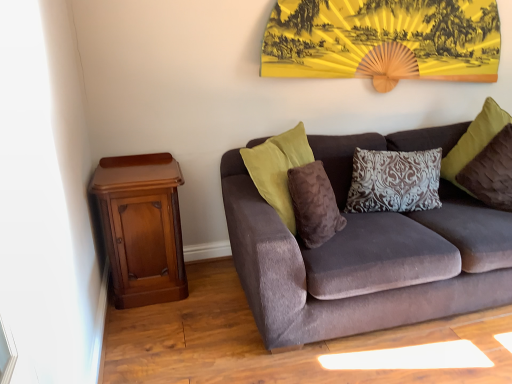
Question: From a real-world perspective, is velvet brown couch at center positioned under mahogany wood nightstand at left based on gravity?

Choices:
 (A) yes
 (B) no

Answer: (B)

Question: Considering the relative positions of velvet brown couch at center and mahogany wood nightstand at left in the image provided, is velvet brown couch at center to the left of mahogany wood nightstand at left from the viewer's perspective?

Choices:
 (A) yes
 (B) no

Answer: (B)

Question: Is velvet brown couch at center taller than mahogany wood nightstand at left?

Choices:
 (A) no
 (B) yes

Answer: (B)

Question: Does velvet brown couch at center lie behind mahogany wood nightstand at left?

Choices:
 (A) yes
 (B) no

Answer: (B)

Question: Considering the relative sizes of velvet brown couch at center and mahogany wood nightstand at left in the image provided, is velvet brown couch at center bigger than mahogany wood nightstand at left?

Choices:
 (A) yes
 (B) no

Answer: (A)

Question: Is velvet brown pillow at upper right, marked as the 1th pillow in a right-to-left arrangement, to the left or to the right of velvet brown couch at center in the image?

Choices:
 (A) left
 (B) right

Answer: (B)

Question: From the image's perspective, is velvet brown pillow at upper right, marked as the 1th pillow in a right-to-left arrangement, above or below velvet brown couch at center?

Choices:
 (A) above
 (B) below

Answer: (A)

Question: In terms of height, does velvet brown pillow at upper right, marked as the 1th pillow in a right-to-left arrangement, look taller or shorter compared to velvet brown couch at center?

Choices:
 (A) tall
 (B) short

Answer: (B)

Question: Relative to velvet brown couch at center, is velvet brown pillow at upper right, marked as the 1th pillow in a right-to-left arrangement, in front or behind?

Choices:
 (A) front
 (B) behind

Answer: (B)

Question: Would you say mahogany wood nightstand at left is inside or outside brown damask pillow at center, placed as the 2th pillow when sorted from left to right?

Choices:
 (A) outside
 (B) inside

Answer: (A)

Question: Relative to brown damask pillow at center, placed as the 2th pillow when sorted from left to right, is mahogany wood nightstand at left in front or behind?

Choices:
 (A) front
 (B) behind

Answer: (A)

Question: Looking at their shapes, would you say mahogany wood nightstand at left is wider or thinner than brown damask pillow at center, the 2th pillow viewed from the right?

Choices:
 (A) thin
 (B) wide

Answer: (B)

Question: From a real-world perspective, is mahogany wood nightstand at left positioned above or below brown damask pillow at center, placed as the 2th pillow when sorted from left to right?

Choices:
 (A) above
 (B) below

Answer: (B)

Question: From the image's perspective, is yellow paper fan at upper center located above or below brown damask pillow at center, the 2th pillow viewed from the right?

Choices:
 (A) below
 (B) above

Answer: (B)

Question: In the image, is yellow paper fan at upper center on the left side or the right side of brown damask pillow at center, the 2th pillow viewed from the right?

Choices:
 (A) right
 (B) left

Answer: (B)